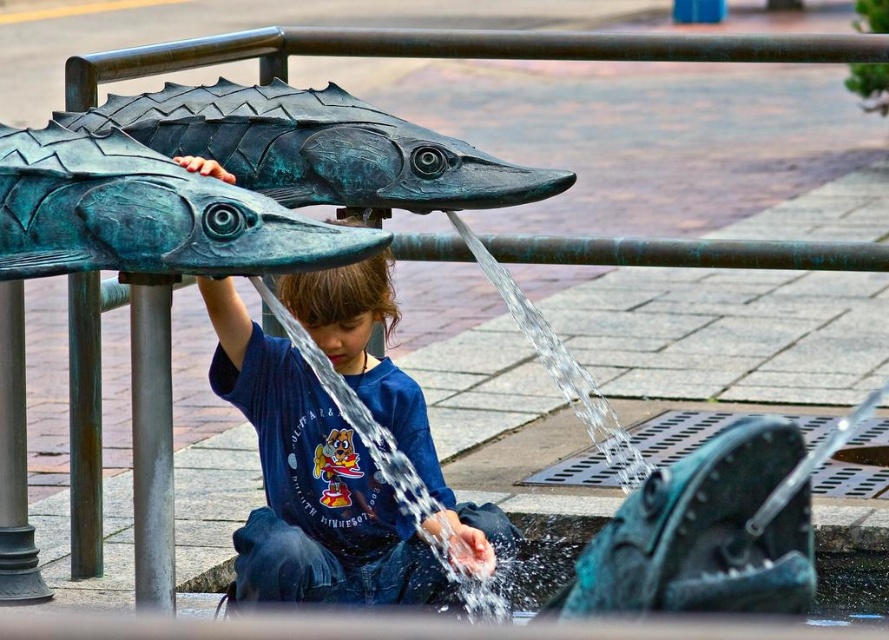
Does matte blue shirt at center have a lesser height compared to green patina bronze fish at upper left?

No.

Is matte blue shirt at center further to the viewer compared to green patina bronze fish at upper left?

Yes.

Between point (415, 420) and point (130, 259), which one is positioned in front?

Point (130, 259)

Find the location of a particular element. This screenshot has width=889, height=640. matte blue shirt at center is located at coordinates (310, 483).